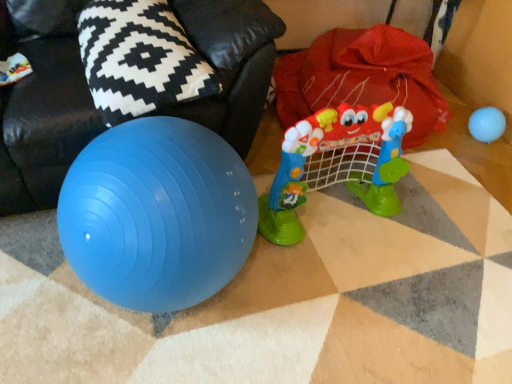
You are a GUI agent. You are given a task and a screenshot of the screen. Output one action in this format:
    pyautogui.click(x=<x>, y=<y>)
    Task: Click on the vacant space to the right of plastic toy at center, arranged as the second toy when viewed from the back
    This screenshot has height=384, width=512.
    Given the screenshot: What is the action you would take?
    pyautogui.click(x=437, y=231)